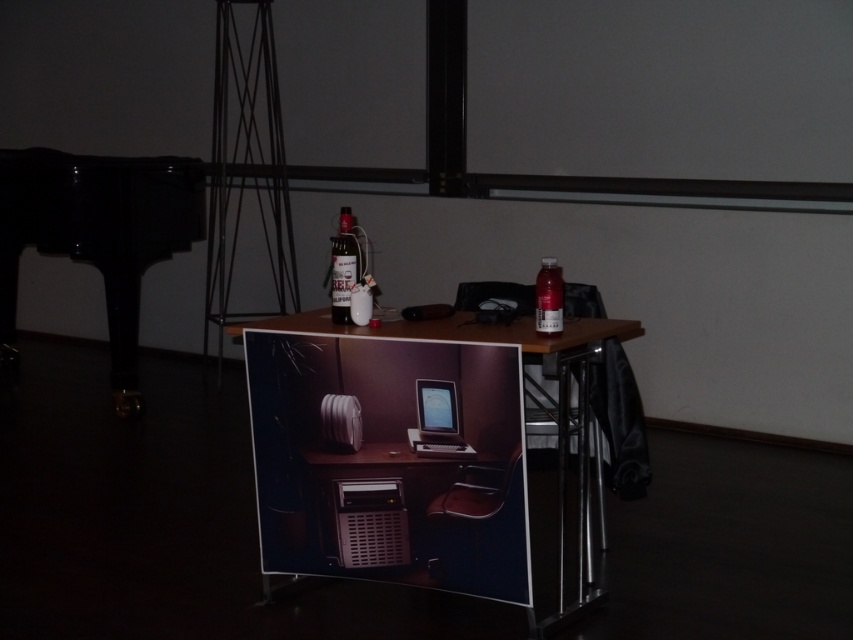
You are organizing items on a table and need to place a new item exactly at the center of the table. The matte black monitor at center is currently at coordinates point 0.658, 0.513. Is the monitor already positioned at the table center?

The matte black monitor at center is located at point (437, 420), which indicates it is placed at the center of the table as described.

You are standing at point A located at coordinates point A at (x=444, y=445). You want to walk to point B, which is 2.68 meters away from you. Is there enough space to walk directly to point B without moving any objects on the table?

The distance between point A at (x=444, y=445) and point B is 2.68 meters. Since the table has various items placed on it, but the description does not mention any obstacles blocking the path, it is possible there is enough space to walk directly to point B without moving any objects.